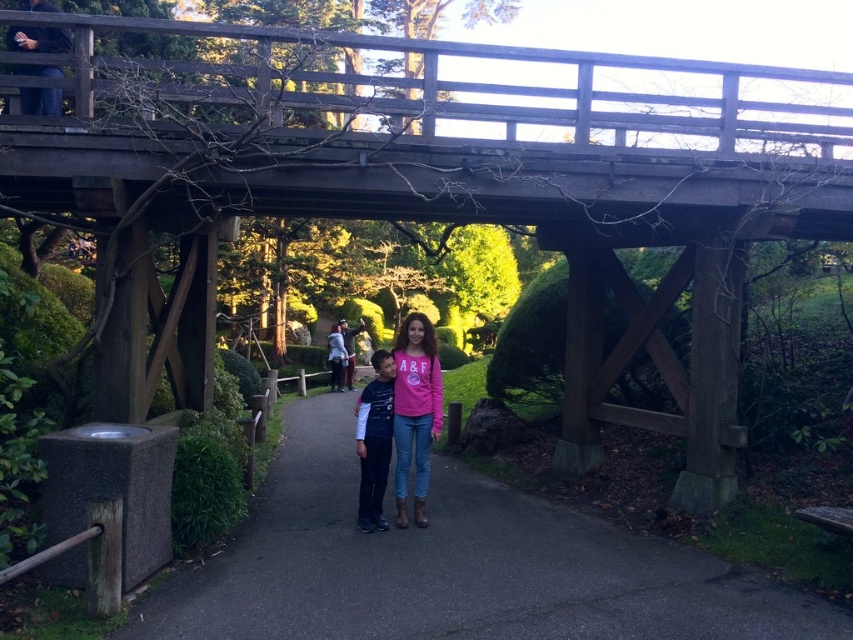
Can you confirm if pink cotton shirt at center is wider than matte blue jeans at center?

Yes, pink cotton shirt at center is wider than matte blue jeans at center.

Does pink cotton shirt at center have a lesser width compared to matte blue jeans at center?

No.

Based on the photo, who is more distant from viewer, (x=407, y=422) or (x=358, y=401)?

The point (x=358, y=401) is behind.

Where is `pink cotton shirt at center`? pink cotton shirt at center is located at coordinates (415, 412).

Is black asphalt path at center taller than pink cotton shirt at center?

No.

Does point (503, 625) come behind point (425, 320)?

No, (503, 625) is closer to viewer.

Locate an element on the screen. The width and height of the screenshot is (853, 640). black asphalt path at center is located at coordinates (453, 566).

Does black asphalt path at center have a smaller size compared to matte blue jeans at center?

Yes.

Which is below, black asphalt path at center or matte blue jeans at center?

black asphalt path at center

Describe the element at coordinates (453, 566) in the screenshot. The image size is (853, 640). I see `black asphalt path at center` at that location.

In order to click on black asphalt path at center in this screenshot , I will do (453, 566).